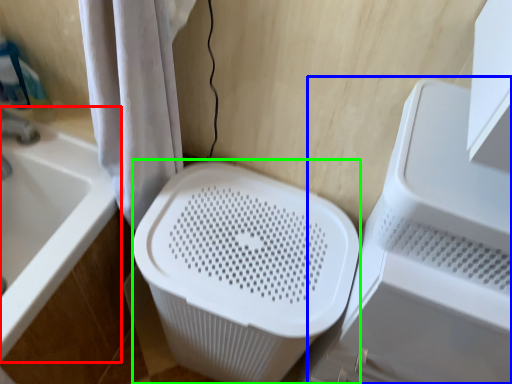
Question: Which is farther away from bathtub (highlighted by a red box)? appliance (highlighted by a blue box) or laundry basket (highlighted by a green box)?

Choices:
 (A) appliance
 (B) laundry basket

Answer: (A)